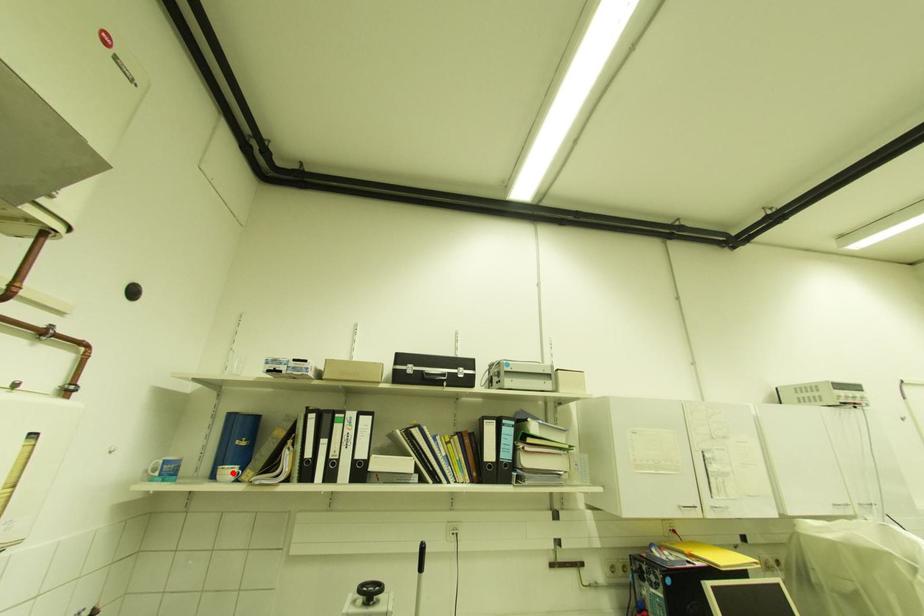
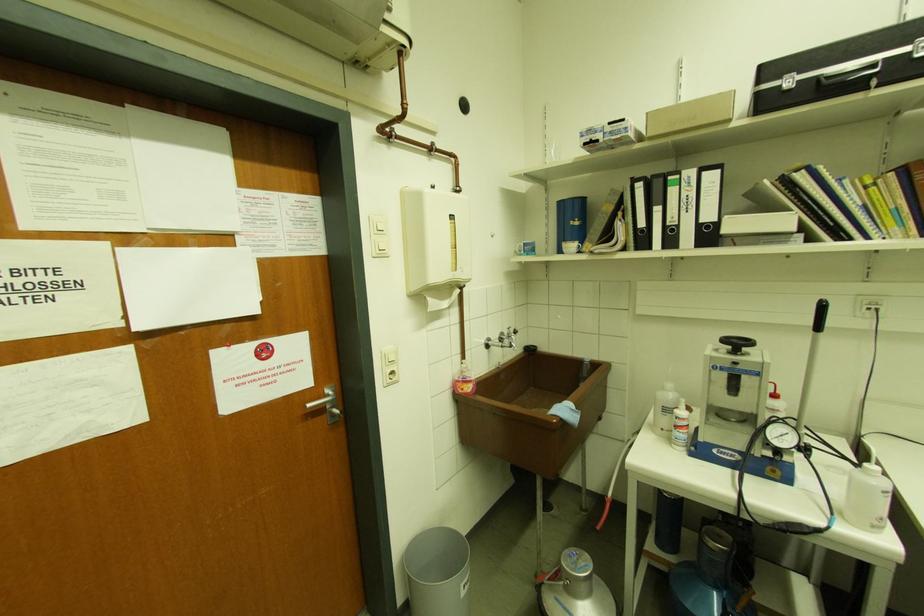
Locate, in the second image, the point that corresponds to the highlighted location in the first image.

(575, 246)